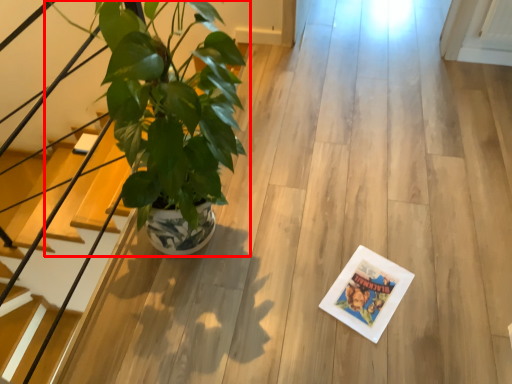
Question: Where is houseplant (annotated by the red box) located in relation to stairs in the image?

Choices:
 (A) left
 (B) right

Answer: (B)